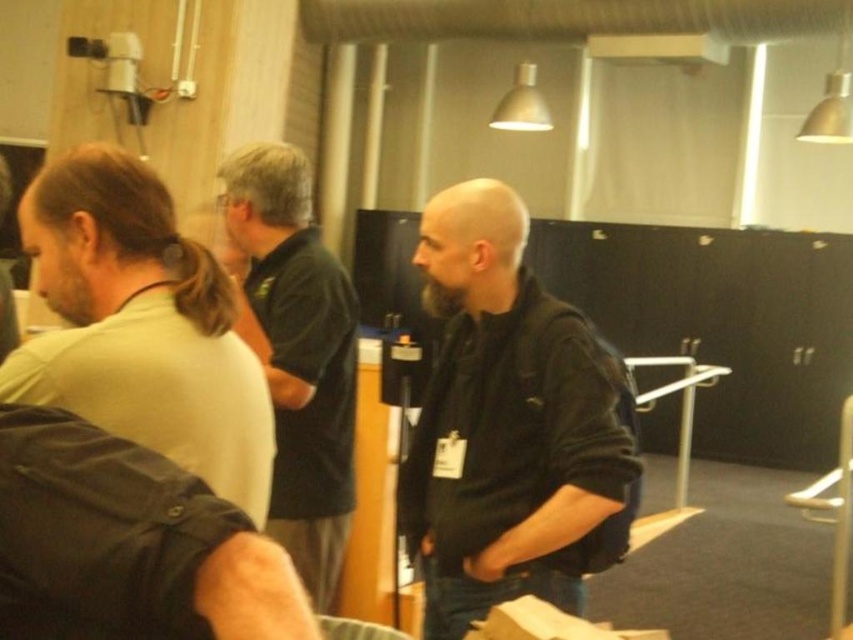
Where is `light green shirt at left`? The height and width of the screenshot is (640, 853). light green shirt at left is located at coordinates (140, 324).

Does light green shirt at left lie in front of dark green jersey at center?

Yes, light green shirt at left is closer to the viewer.

Who is more distant from viewer, (194, 420) or (316, 413)?

The point (316, 413) is more distant.

I want to click on light green shirt at left, so click(x=140, y=324).

Is point (595, 524) more distant than point (166, 392)?

Yes, it is behind point (166, 392).

Is the position of black matte jacket at center less distant than that of light green shirt at left?

No.

At what (x,y) coordinates should I click in order to perform the action: click on black matte jacket at center. Please return your answer as a coordinate pair (x, y). Looking at the image, I should click on (508, 422).

Who is higher up, black matte jacket at center or dark green jersey at center?

black matte jacket at center

Who is shorter, black matte jacket at center or dark green jersey at center?

black matte jacket at center is shorter.

Which is in front, point (436, 289) or point (289, 392)?

Positioned in front is point (436, 289).

The height and width of the screenshot is (640, 853). Identify the location of black matte jacket at center. (508, 422).